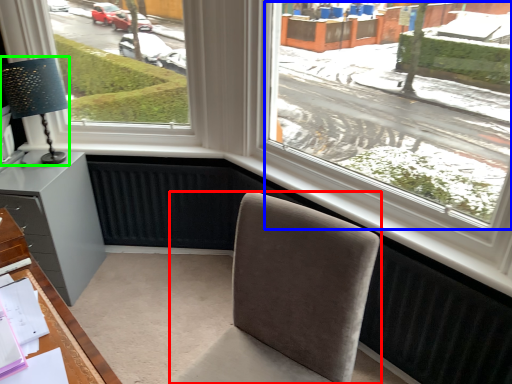
Question: Estimate the real-world distances between objects in this image. Which object is closer to chair (highlighted by a red box), window screen (highlighted by a blue box) or table lamp (highlighted by a green box)?

Choices:
 (A) window screen
 (B) table lamp

Answer: (A)